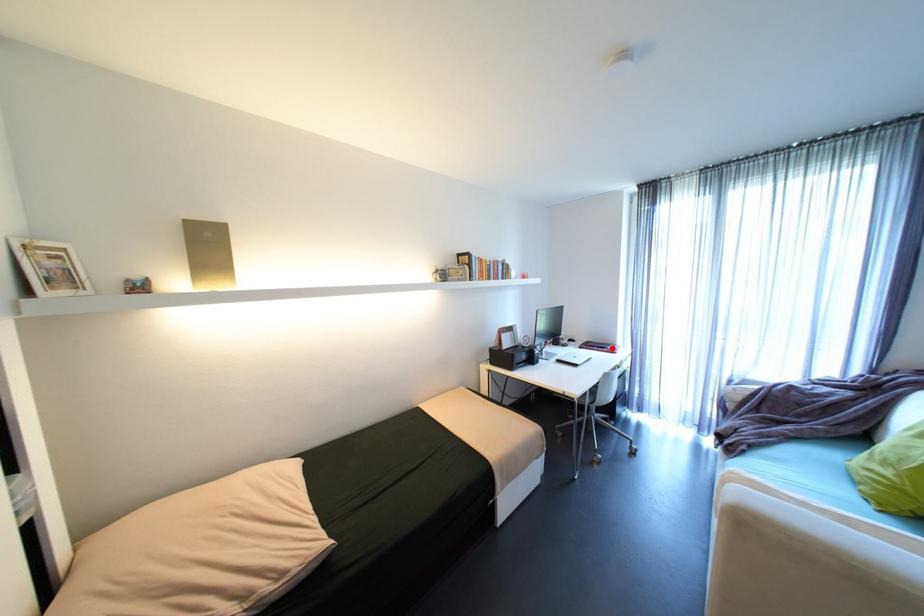
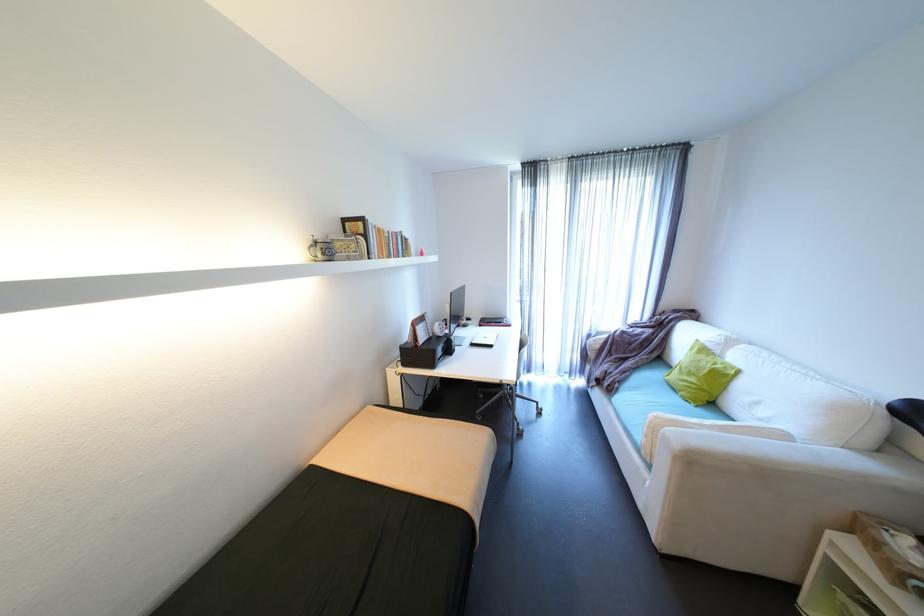
Question: I am providing you with two images of the same scene from different viewpoints. A red point is marked on the first image. Is the red point's position out of view in image 2?

Choices:
 (A) Yes
 (B) No

Answer: (B)